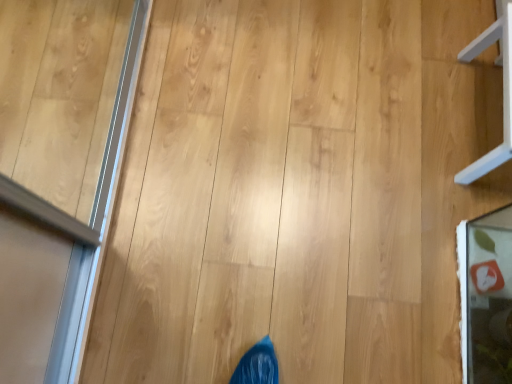
I want to click on vacant space underneath white matte chair at right (from a real-world perspective), so click(479, 115).